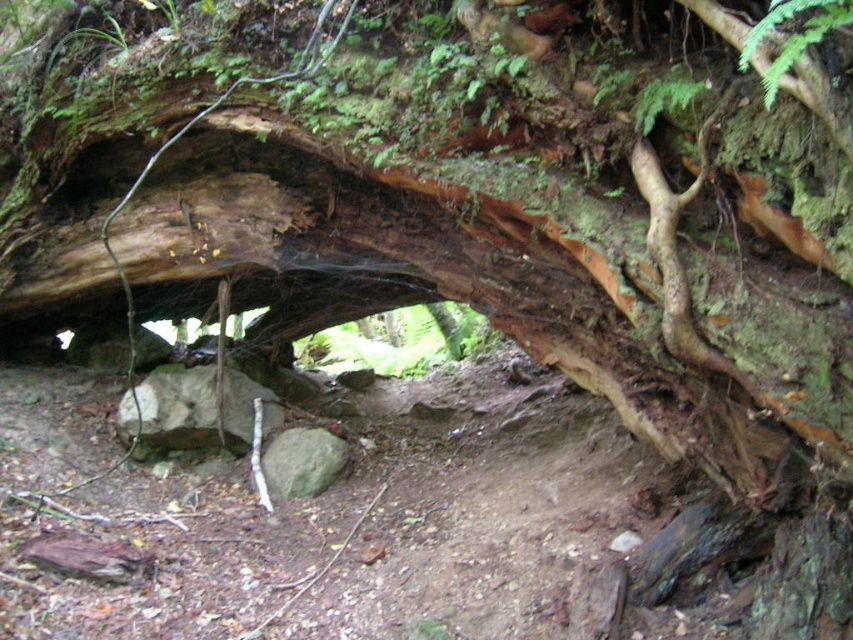
You are a hiker who wants to step over the gray rock at center and the green rough rock at center. Which rock do you need to exert more effort to step over?

The gray rock at center is much taller than the green rough rock at center, so you need to exert more effort to step over the gray rock at center.

Consider the image. You are standing on the dirt path under the fallen tree trunk archway. You notice two points marked on the ground. One is at coordinate point (200, 445) and the other at point (328, 467). If you want to reach the point closer to you first, which coordinate should you head towards?

You should head towards point (200, 445) because it is closer to you than point (328, 467).

You are a hiker standing on the dirt path under the fallen tree trunk archway. You see a gray rock at center and a green rough rock at center. Which rock is closer to you as you face the archway?

The gray rock at center is closer to you because the green rough rock at center is behind it.